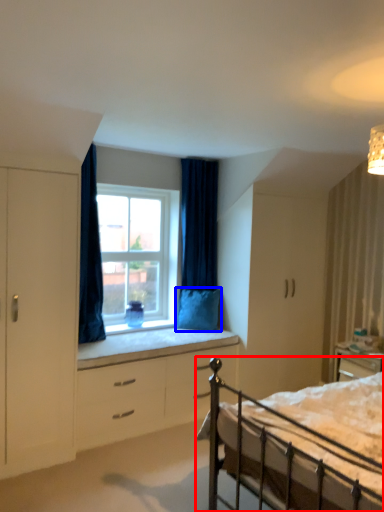
Question: Which of the following is the closest to the observer, bed (highlighted by a red box) or pillow (highlighted by a blue box)?

Choices:
 (A) bed
 (B) pillow

Answer: (A)